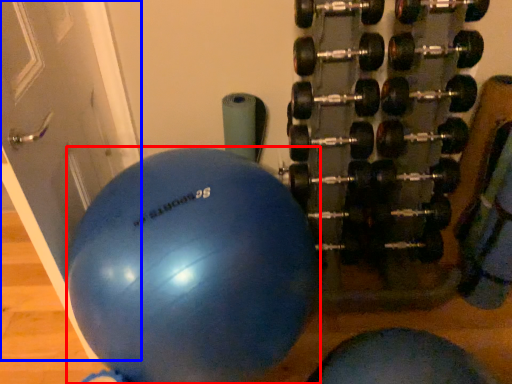
Question: Which point is closer to the camera, ball (highlighted by a red box) or door (highlighted by a blue box)?

Choices:
 (A) ball
 (B) door

Answer: (B)